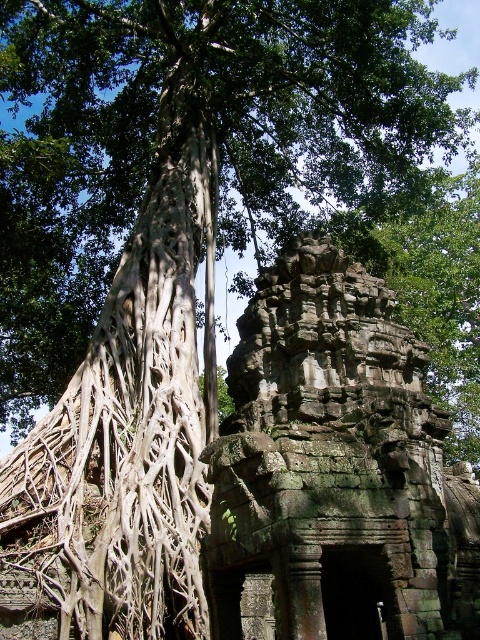
Measure the distance between gray stone ruins at center and white textured roots at left.

14.26 meters

Looking at this image, which is more to the left, gray stone ruins at center or white textured roots at left?

white textured roots at left is more to the left.

Is point (275, 582) behind point (142, 452)?

Yes, point (275, 582) is farther from viewer.

Identify the location of gray stone ruins at center. (336, 467).